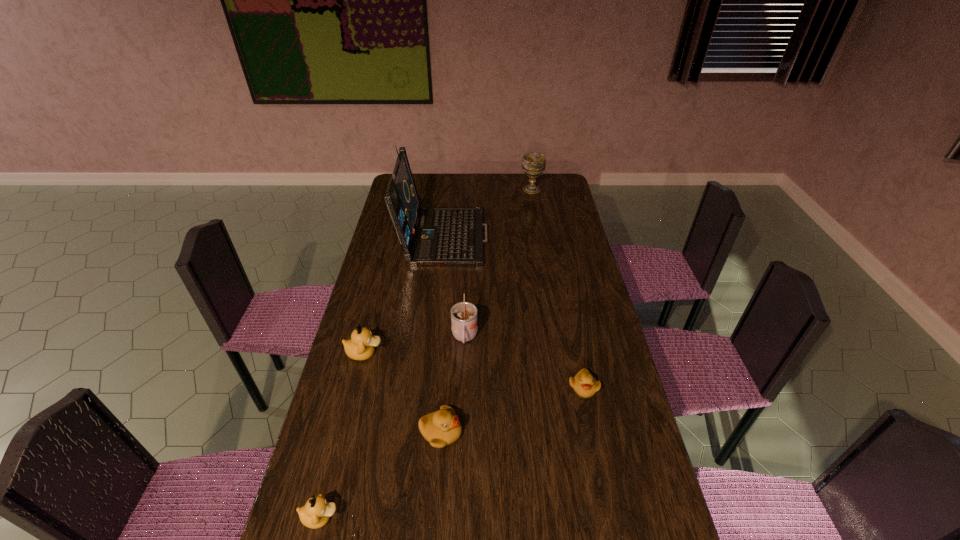
Where is `free area in between the second duckling from right to left and the bigger tan duckling`? The image size is (960, 540). free area in between the second duckling from right to left and the bigger tan duckling is located at coordinates (402, 393).

Find the location of a particular element. Image resolution: width=960 pixels, height=540 pixels. empty space that is in between the cup and the second duckling from right to left is located at coordinates 453,385.

Locate an element on the screen. vacant area between the cup and the bigger yellow duckling is located at coordinates pos(453,385).

Locate an element on the screen. The height and width of the screenshot is (540, 960). vacant area between the bigger yellow duckling and the right yellow duckling is located at coordinates (513, 410).

The height and width of the screenshot is (540, 960). Find the location of `vacant space that's between the second farthest object and the farthest duckling`. vacant space that's between the second farthest object and the farthest duckling is located at coordinates (404, 293).

Identify the location of object that is the fifth closest to the farthest duckling. This screenshot has height=540, width=960. (584, 384).

Locate an element on the screen. The width and height of the screenshot is (960, 540). object that stands as the second closest to the second farthest object is located at coordinates (464, 321).

At what (x,y) coordinates should I click in order to perform the action: click on duckling that stands as the fourth closest to the laptop computer. Please return your answer as a coordinate pair (x, y). The height and width of the screenshot is (540, 960). Looking at the image, I should click on (316, 513).

Point out which duckling is positioned as the nearest to the nearest object. Please provide its 2D coordinates. Your answer should be formatted as a tuple, i.e. [(x, y)], where the tuple contains the x and y coordinates of a point satisfying the conditions above.

[(440, 428)]

Locate an element on the screen. The height and width of the screenshot is (540, 960). free space that satisfies the following two spatial constraints: 1. on the side with the handle of the cup; 2. on the face of the nearest object is located at coordinates (459, 517).